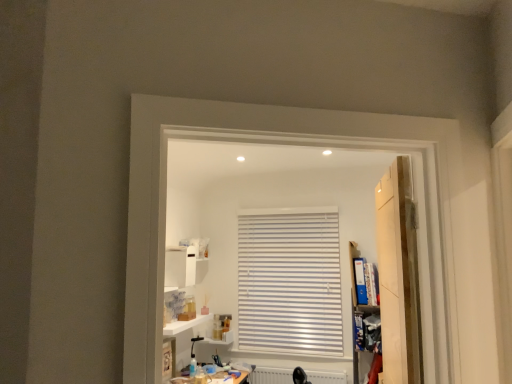
Question: Considering the relative sizes of wooden door at right and white glossy cabinet at upper center in the image provided, is wooden door at right thinner than white glossy cabinet at upper center?

Choices:
 (A) yes
 (B) no

Answer: (A)

Question: Is white glossy cabinet at upper center inside wooden door at right?

Choices:
 (A) yes
 (B) no

Answer: (B)

Question: Is wooden door at right positioned in front of white glossy cabinet at upper center?

Choices:
 (A) no
 (B) yes

Answer: (B)

Question: Are wooden door at right and white glossy cabinet at upper center far apart?

Choices:
 (A) no
 (B) yes

Answer: (B)

Question: Considering the relative positions of wooden door at right and white glossy cabinet at upper center in the image provided, is wooden door at right behind white glossy cabinet at upper center?

Choices:
 (A) yes
 (B) no

Answer: (B)

Question: Visually, is wooden door at right positioned to the left or to the right of white glossy shelf at lower center?

Choices:
 (A) left
 (B) right

Answer: (B)

Question: From a real-world perspective, relative to white glossy shelf at lower center, is wooden door at right vertically above or below?

Choices:
 (A) below
 (B) above

Answer: (B)

Question: Looking at their shapes, would you say wooden door at right is wider or thinner than white glossy shelf at lower center?

Choices:
 (A) wide
 (B) thin

Answer: (B)

Question: Is wooden door at right inside the boundaries of white glossy shelf at lower center, or outside?

Choices:
 (A) inside
 (B) outside

Answer: (B)

Question: From the image's perspective, is white glossy cabinet at upper center positioned above or below wooden door at right?

Choices:
 (A) above
 (B) below

Answer: (B)

Question: Is white glossy cabinet at upper center in front of or behind wooden door at right in the image?

Choices:
 (A) front
 (B) behind

Answer: (B)

Question: From their relative heights in the image, would you say white glossy cabinet at upper center is taller or shorter than wooden door at right?

Choices:
 (A) tall
 (B) short

Answer: (B)

Question: From a real-world perspective, is white glossy cabinet at upper center above or below wooden door at right?

Choices:
 (A) below
 (B) above

Answer: (B)

Question: Based on their positions, is white matte radiator at lower center located to the left or right of wooden door at right?

Choices:
 (A) right
 (B) left

Answer: (B)

Question: From a real-world perspective, relative to wooden door at right, is white matte radiator at lower center vertically above or below?

Choices:
 (A) above
 (B) below

Answer: (B)